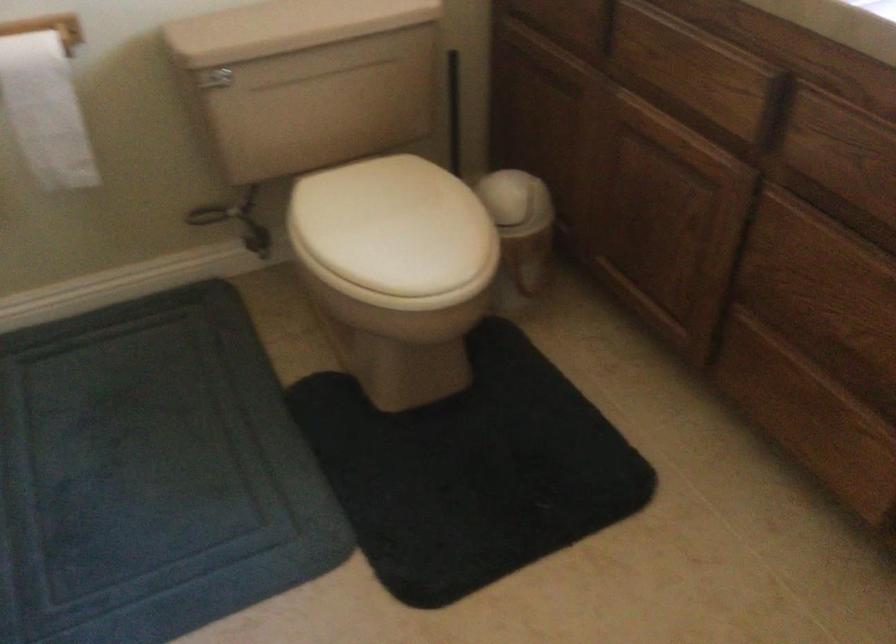
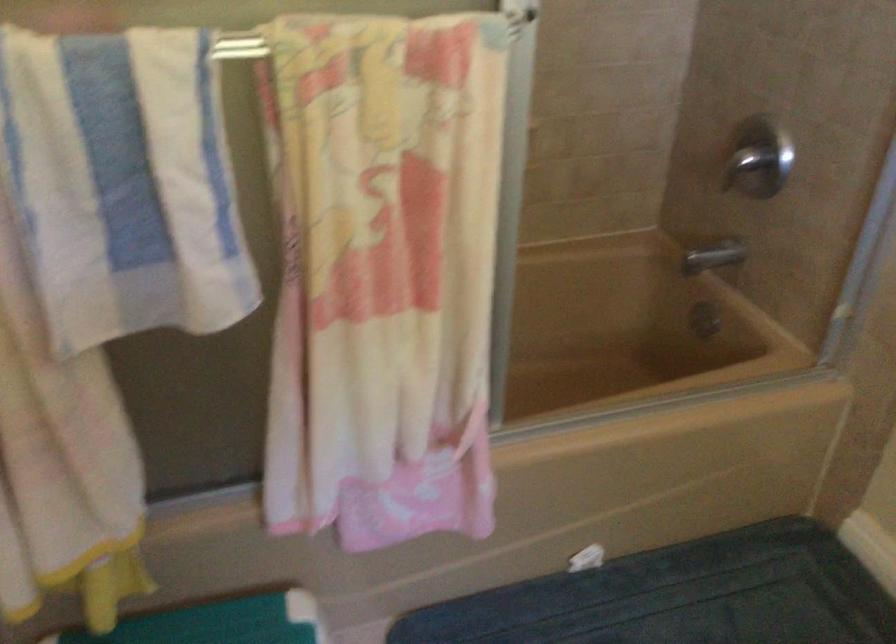
How did the camera likely rotate?

The camera rotated toward left-down.